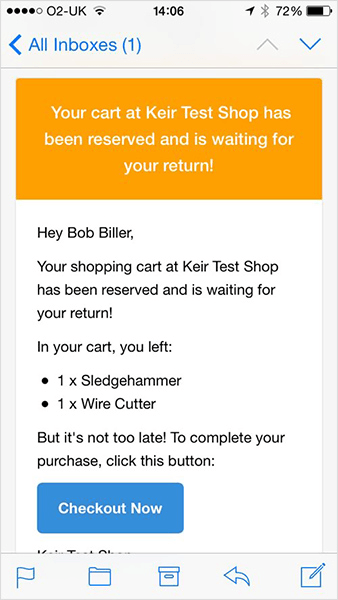
At what (x,y) coordinates should I click in order to perform the action: click on blue file folder. Please return your answer as a coordinate pair (x, y). The width and height of the screenshot is (338, 600). Looking at the image, I should click on (92, 571).